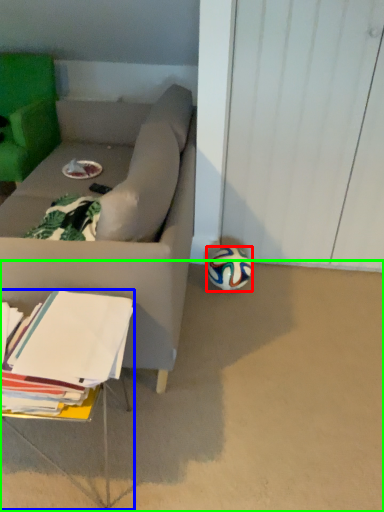
Question: Based on their relative distances, which object is nearer to ball (highlighted by a red box)? Choose from table (highlighted by a blue box) and concrete (highlighted by a green box).

Choices:
 (A) table
 (B) concrete

Answer: (B)